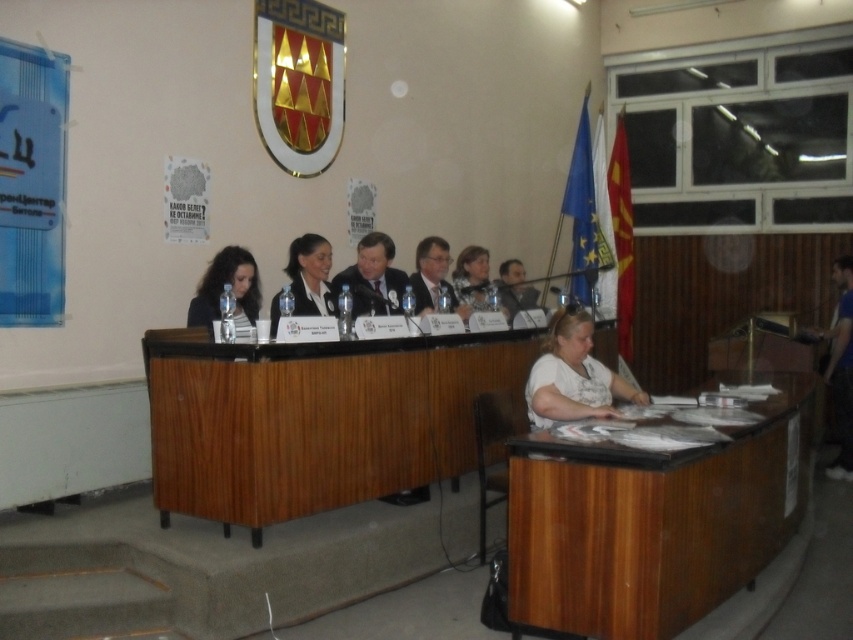
You are standing in the room and want to walk to the wooden table at center. Based on the room layout, in which direction should you head relative to your current position?

The wooden table at center is located at coordinates 0.656 on the x axis and 0.372 on the y axis, so you should head towards the direction where the x coordinate increases and the y coordinate decreases to reach it.

You are a photographer standing in the room. You need to take a photo of both the white matte shirt at lower right and the matte black jacket at upper center. The minimum distance between the two subjects in the photo should be 4 feet to ensure clarity. Based on the scene description, will the subjects be positioned far enough apart for the photo?

The white matte shirt at lower right and the matte black jacket at upper center are 3.82 feet apart from each other. Since 3.82 feet is less than the required 4 feet, the subjects will not be positioned far enough apart for the photo.